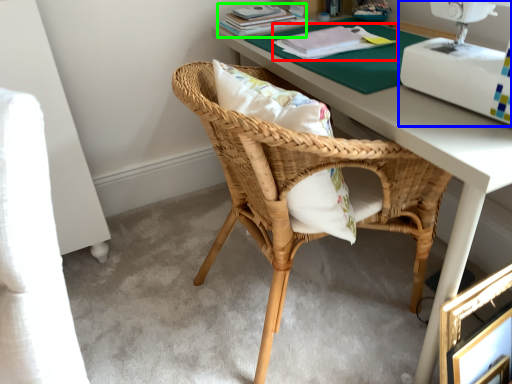
Question: Based on their relative distances, which object is nearer to book (highlighted by a red box)? Choose from sewing machine (highlighted by a blue box) and book (highlighted by a green box).

Choices:
 (A) sewing machine
 (B) book

Answer: (B)